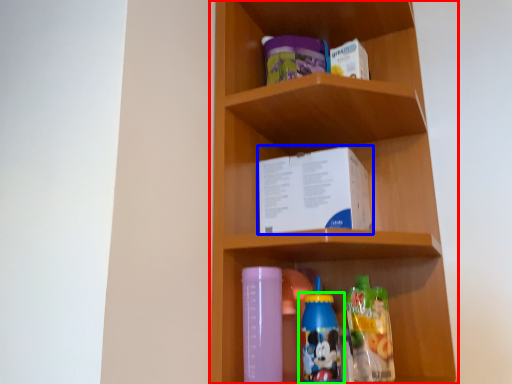
Question: Considering the real-world distances, which object is closest to shelf (highlighted by a red box)? book (highlighted by a blue box) or bottle (highlighted by a green box).

Choices:
 (A) book
 (B) bottle

Answer: (A)